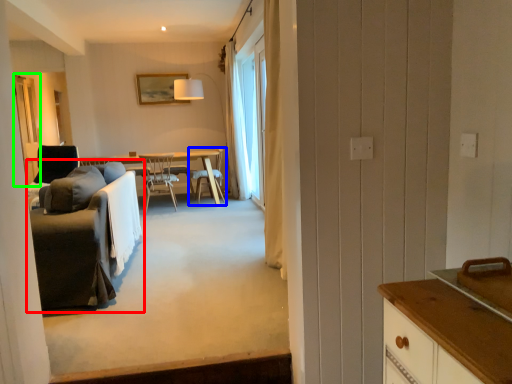
Question: Considering the real-world distances, which object is closest to studio couch (highlighted by a red box)? chair (highlighted by a blue box) or screen door (highlighted by a green box).

Choices:
 (A) chair
 (B) screen door

Answer: (B)